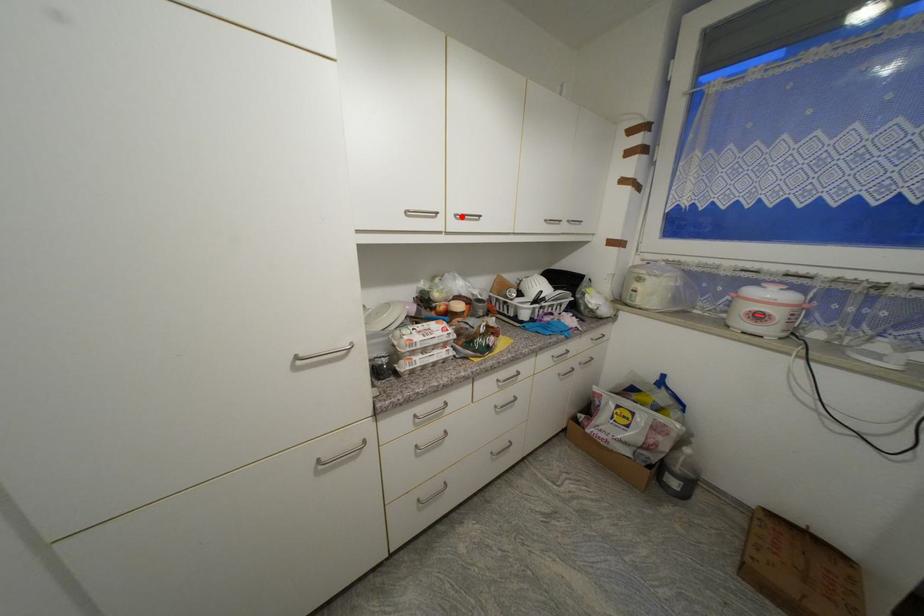
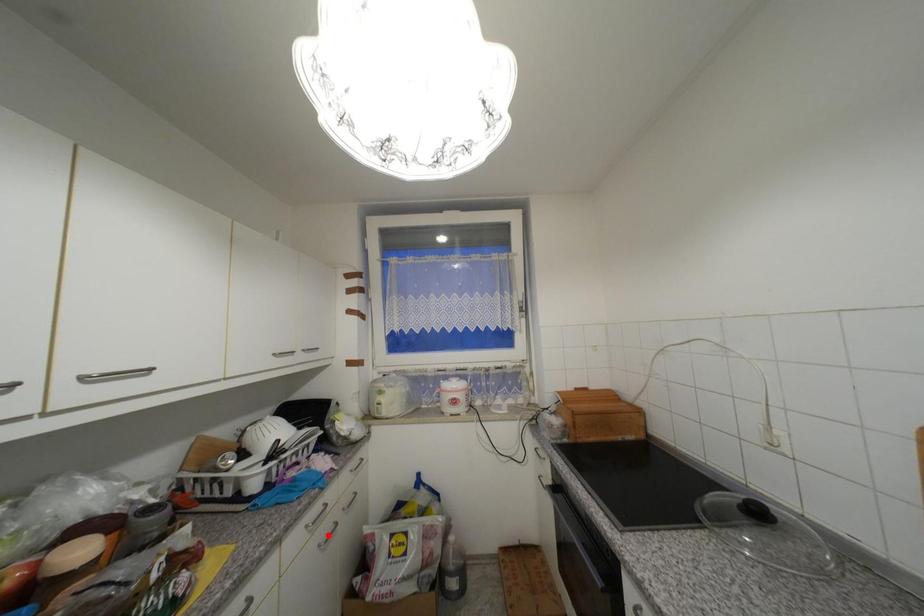
I am providing you with two images of the same scene from different viewpoints. A red point is marked on the first image and another point is marked on the second image. Are the points marked in image1 and image2 representing the same 3D position?

No